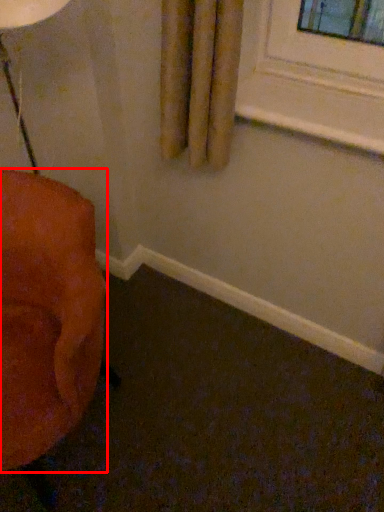
Question: From the image's perspective, what is the correct spatial positioning of furniture (annotated by the red box) in reference to window sill?

Choices:
 (A) above
 (B) below

Answer: (B)